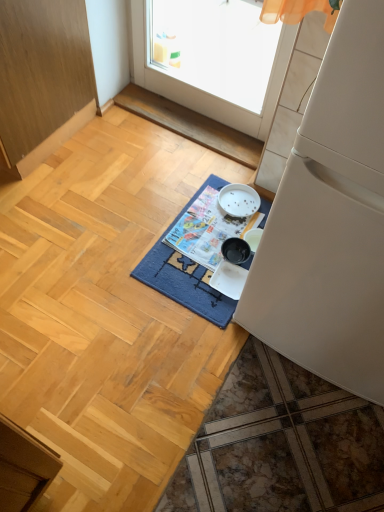
Locate an element on the screen. free space to the back side of blue woven mat at center is located at coordinates (181, 158).